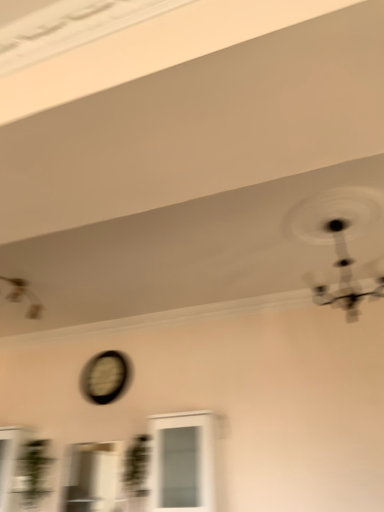
Question: Does white glass cabinet at center, the first window in the right-to-left sequence, have a smaller size compared to clear glass window at center, positioned as the 2th window in right-to-left order?

Choices:
 (A) no
 (B) yes

Answer: (A)

Question: Is white glass cabinet at center, the first window in the right-to-left sequence, not inside clear glass window at center, marked as the 1th window in a left-to-right arrangement?

Choices:
 (A) no
 (B) yes

Answer: (B)

Question: Is white glass cabinet at center, the first window in the right-to-left sequence, looking in the opposite direction of clear glass window at center, positioned as the 2th window in right-to-left order?

Choices:
 (A) no
 (B) yes

Answer: (A)

Question: From a real-world perspective, is white glass cabinet at center, the first window in the right-to-left sequence, on top of clear glass window at center, positioned as the 2th window in right-to-left order?

Choices:
 (A) no
 (B) yes

Answer: (B)

Question: From the image's perspective, does white glass cabinet at center, positioned as the 2th window in left-to-right order, appear lower than clear glass window at center, positioned as the 2th window in right-to-left order?

Choices:
 (A) yes
 (B) no

Answer: (B)

Question: In terms of width, does metallic silver mechanical fan at upper left, positioned as the second mechanical fan in front-to-back order, look wider or thinner when compared to matte black clock at center?

Choices:
 (A) wide
 (B) thin

Answer: (A)

Question: Would you say metallic silver mechanical fan at upper left, positioned as the first mechanical fan in back-to-front order, is to the left or to the right of matte black clock at center in the picture?

Choices:
 (A) left
 (B) right

Answer: (A)

Question: From their relative heights in the image, would you say metallic silver mechanical fan at upper left, positioned as the second mechanical fan in front-to-back order, is taller or shorter than matte black clock at center?

Choices:
 (A) tall
 (B) short

Answer: (B)

Question: Is point (8, 280) positioned closer to the camera than point (99, 377)?

Choices:
 (A) closer
 (B) farther

Answer: (A)

Question: Is matte black clock at center taller or shorter than metallic silver mechanical fan at upper left, positioned as the second mechanical fan in front-to-back order?

Choices:
 (A) short
 (B) tall

Answer: (B)

Question: From the image's perspective, is matte black clock at center above or below metallic silver mechanical fan at upper left, marked as the first mechanical fan in a left-to-right arrangement?

Choices:
 (A) below
 (B) above

Answer: (A)

Question: Based on their sizes in the image, would you say matte black clock at center is bigger or smaller than metallic silver mechanical fan at upper left, the 2th mechanical fan in the right-to-left sequence?

Choices:
 (A) big
 (B) small

Answer: (A)

Question: In the image, is matte black clock at center positioned in front of or behind metallic silver mechanical fan at upper left, positioned as the first mechanical fan in back-to-front order?

Choices:
 (A) behind
 (B) front

Answer: (A)

Question: From a real-world perspective, is white glass cabinet at center, positioned as the 2th window in left-to-right order, positioned above or below clear glass window at center, positioned as the 2th window in right-to-left order?

Choices:
 (A) above
 (B) below

Answer: (A)

Question: Considering the relative positions of white glass cabinet at center, positioned as the 2th window in left-to-right order, and clear glass window at center, positioned as the 2th window in right-to-left order, in the image provided, is white glass cabinet at center, positioned as the 2th window in left-to-right order, to the left or to the right of clear glass window at center, positioned as the 2th window in right-to-left order,?

Choices:
 (A) left
 (B) right

Answer: (B)